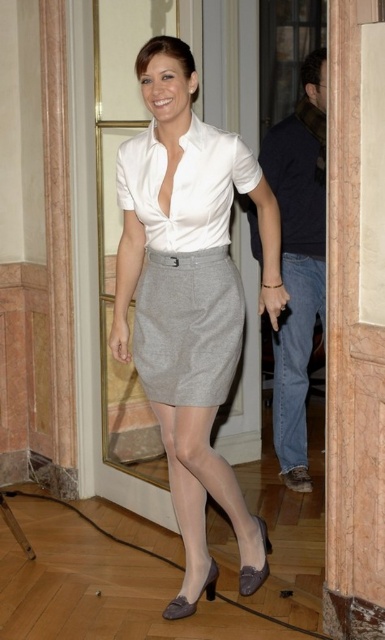
You are a fashion designer observing a model wearing denim jeans at right and gray wool skirt at center. Which clothing item has a narrower width?

The denim jeans at right has a narrower width than the gray wool skirt at center.

You are a fashion designer observing the woman in the scene. You need to determine if the gray wool skirt at center will cover the matte gray heel at lower center when she sits down. Can you confirm this?

The gray wool skirt at center is taller than matte gray heel at lower center, so when she sits down, the skirt will likely cover the heel since it extends lower than the heel.